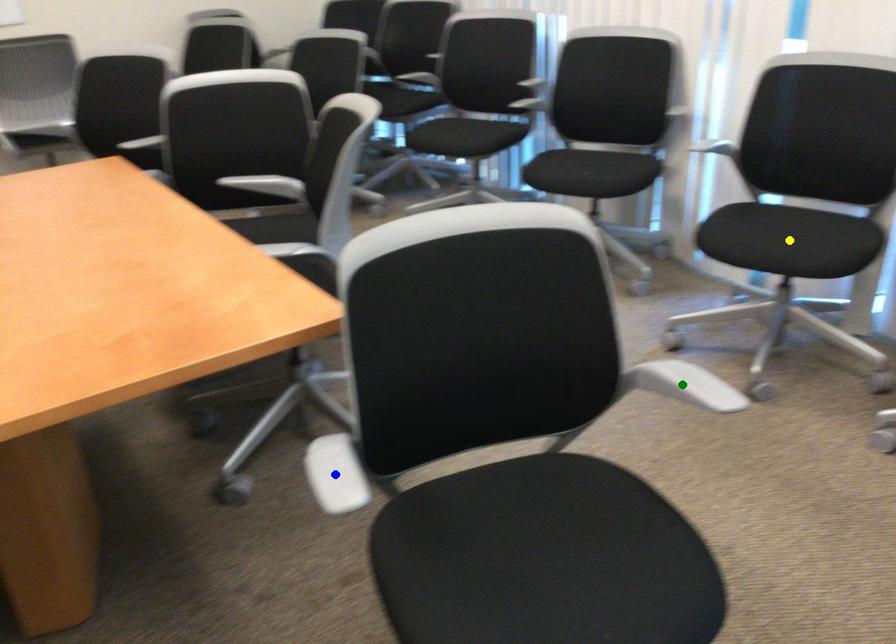
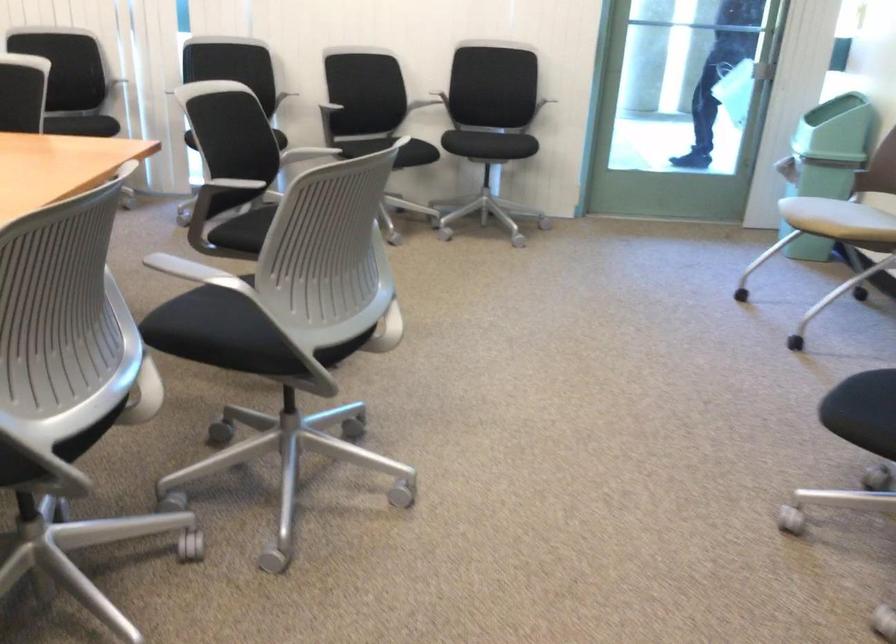
I am providing you with two images of the same scene from different viewpoints. Three points are marked in image1. Which point corresponds to a part or object that is occluded in image2?In image1, three points are marked. Which of them correspond to a part or object that is occluded in image2?Among the three points shown in image1, which one corresponds to a part or object that is no longer visible due to occlusion in image2?

yellow point, green point, blue point cannot be seen in image2.